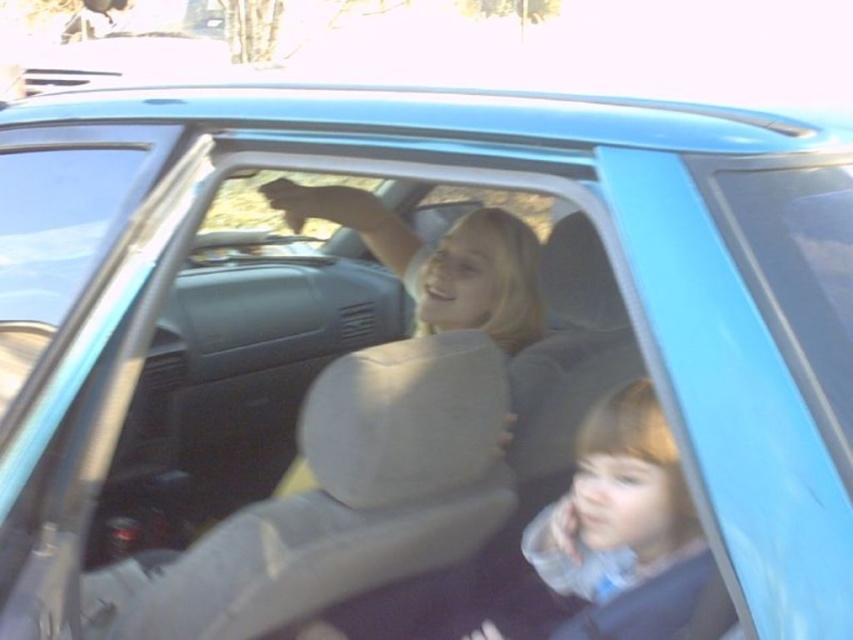
You are a car seat installer and need to ensure the baby fits safely in the car seat. Given that the smooth beige baby at center is placed on the light beige leather seat at center, can the baby fit comfortably without exceeding the seat width?

The smooth beige baby at center has a width less than the light beige leather seat at center, so the baby can fit comfortably within the seat width.

From the picture: You are a car safety expert assessing the seating arrangement. The smooth beige baby at center is currently sitting on the light beige leather seat at center. According to safety guidelines, the baby should be placed in a car seat that takes up more space than the baby itself. Is the current arrangement compliant with safety standards?

The smooth beige baby at center occupies less space than the light beige leather seat at center, so the current arrangement is compliant with safety standards since the baby is using a car seat that takes up more space than the baby itself.